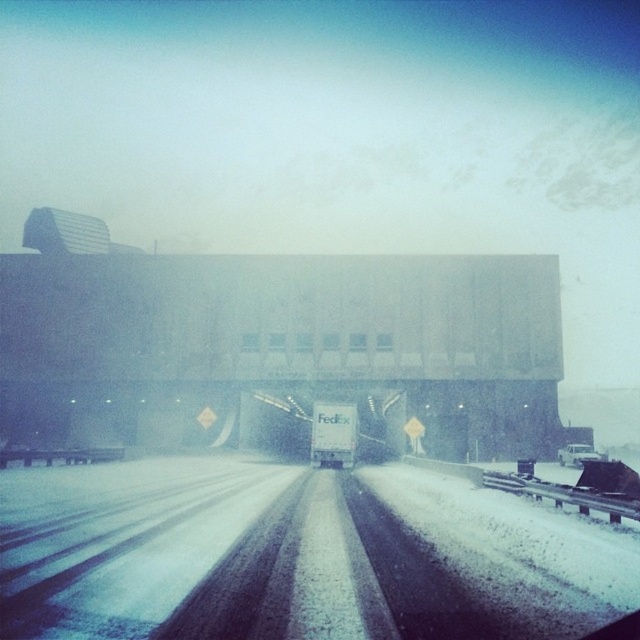
Question: Is white snow-covered highway at center positioned in front of white matte truck at center?

Choices:
 (A) no
 (B) yes

Answer: (B)

Question: Is white snow-covered highway at center below white matte truck at center?

Choices:
 (A) no
 (B) yes

Answer: (A)

Question: Can you confirm if white snow-covered highway at center is positioned to the left of white matte truck at center?

Choices:
 (A) yes
 (B) no

Answer: (A)